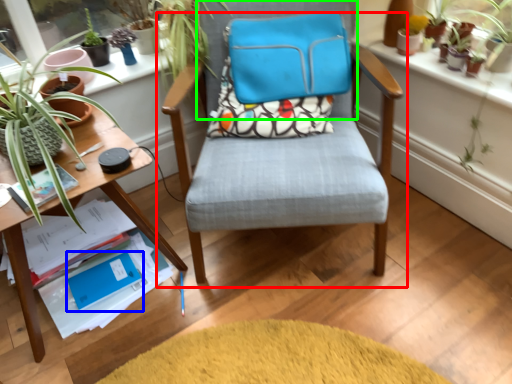
Question: Which is nearer to the chair (highlighted by a red box)? paperback book (highlighted by a blue box) or chair (highlighted by a green box).

Choices:
 (A) paperback book
 (B) chair

Answer: (B)